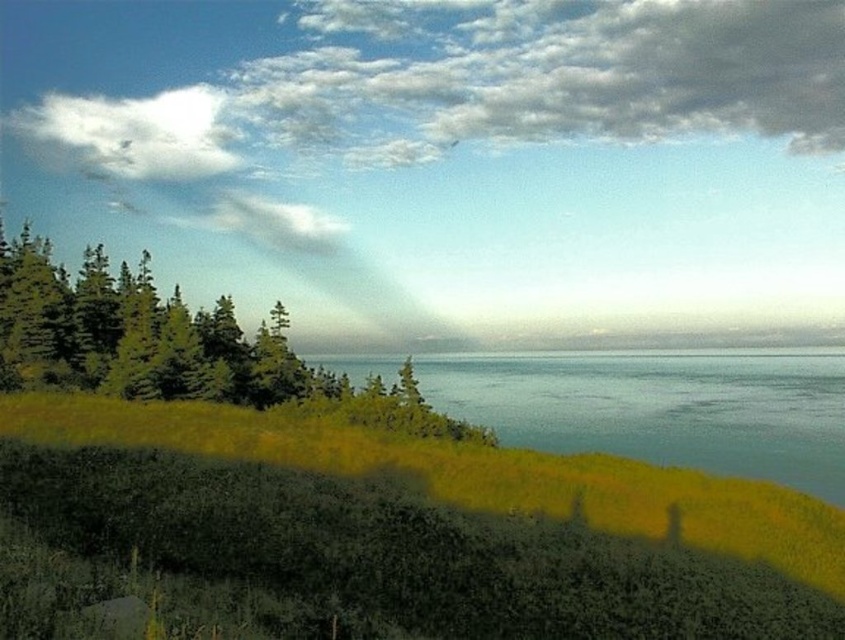
Who is more forward, [274,572] or [601,438]?

Point [274,572] is more forward.

Does green grassy hillside at lower left appear on the left side of greenish-blue water at center?

Correct, you'll find green grassy hillside at lower left to the left of greenish-blue water at center.

This screenshot has height=640, width=845. What are the coordinates of `green grassy hillside at lower left` in the screenshot? It's located at (431, 522).

Where is `green grassy hillside at lower left`? Image resolution: width=845 pixels, height=640 pixels. green grassy hillside at lower left is located at coordinates (x=431, y=522).

Is green grassy hillside at lower left above white fluffy cloud at upper left?

Actually, green grassy hillside at lower left is below white fluffy cloud at upper left.

Is green grassy hillside at lower left wider than white fluffy cloud at upper left?

No.

At what (x,y) coordinates should I click in order to perform the action: click on green grassy hillside at lower left. Please return your answer as a coordinate pair (x, y). The height and width of the screenshot is (640, 845). Looking at the image, I should click on (431, 522).

Does green matte trees at left come behind white fluffy cloud at upper left?

No, it is in front of white fluffy cloud at upper left.

Is green matte trees at left taller than white fluffy cloud at upper left?

Incorrect, green matte trees at left's height is not larger of white fluffy cloud at upper left's.

What do you see at coordinates (134, 336) in the screenshot? This screenshot has height=640, width=845. I see `green matte trees at left` at bounding box center [134, 336].

This screenshot has width=845, height=640. I want to click on green matte trees at left, so click(134, 336).